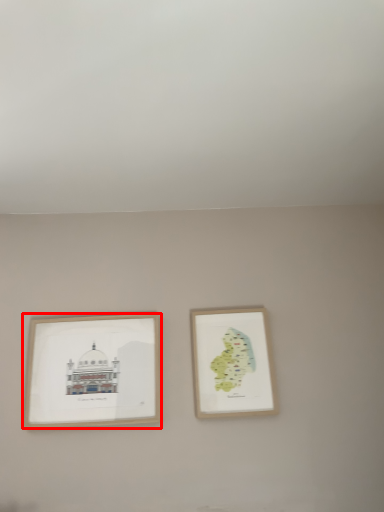
Question: From the image's perspective, what is the correct spatial relationship of picture frame (annotated by the red box) in relation to picture frame?

Choices:
 (A) above
 (B) below

Answer: (B)